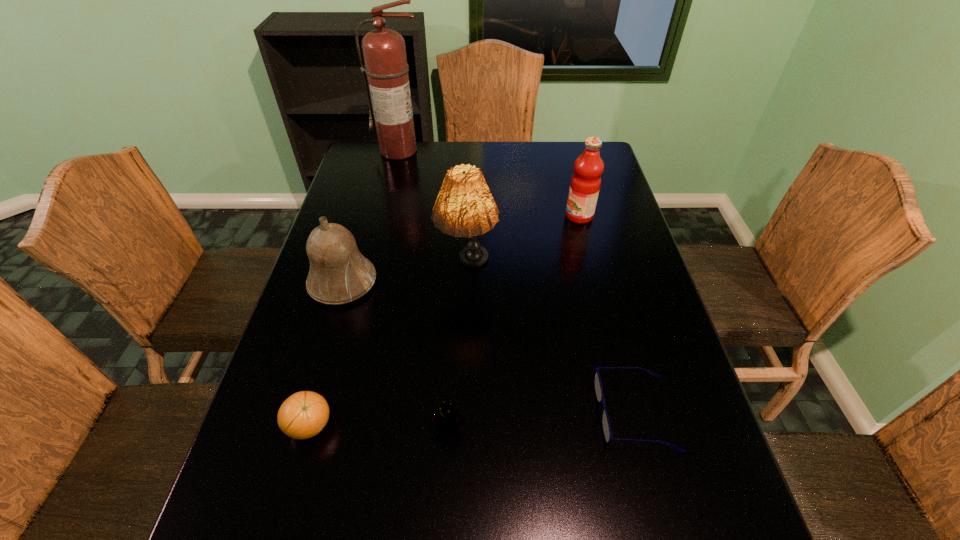
Find the location of `vacant position in the image that satisfies the following two spatial constraints: 1. on the front label of the fifth shortest object; 2. on the front side of the bell`. vacant position in the image that satisfies the following two spatial constraints: 1. on the front label of the fifth shortest object; 2. on the front side of the bell is located at coordinates [596, 282].

The width and height of the screenshot is (960, 540). Identify the location of free region that satisfies the following two spatial constraints: 1. on the front label of the fruit juice; 2. on the front-facing side of the second tallest object. (593, 272).